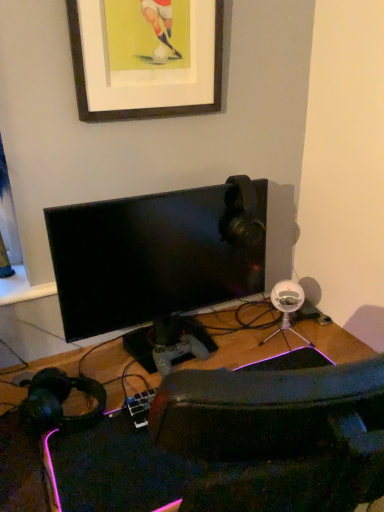
You are a GUI agent. You are given a task and a screenshot of the screen. Output one action in this format:
    pyautogui.click(x=<x>, y=<y>)
    Task: Click on the vacant region below black matte headphones at lower left (from a real-world perspective)
    This screenshot has height=512, width=384.
    Given the screenshot: What is the action you would take?
    pyautogui.click(x=75, y=409)